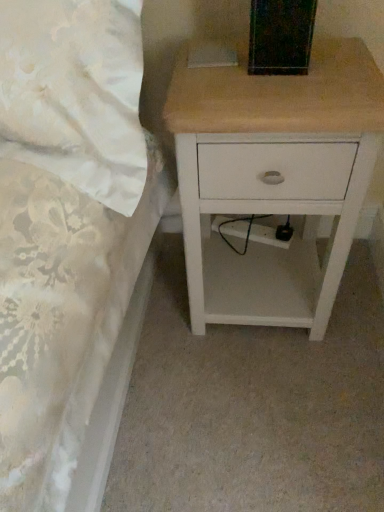
The width and height of the screenshot is (384, 512). Identify the location of free spot above white wood nightstand at upper right (from a real-world perspective). (286, 75).